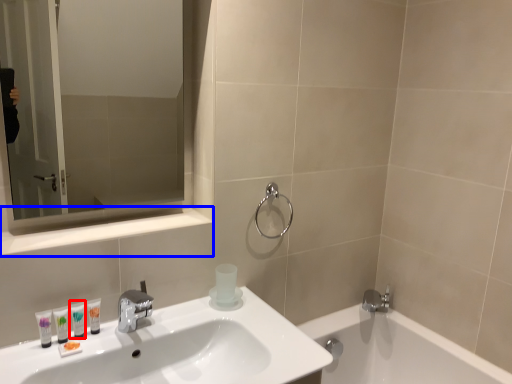
Question: Which of the following is the closest to the observer, mouthwash (highlighted by a red box) or balustrade (highlighted by a blue box)?

Choices:
 (A) mouthwash
 (B) balustrade

Answer: (B)